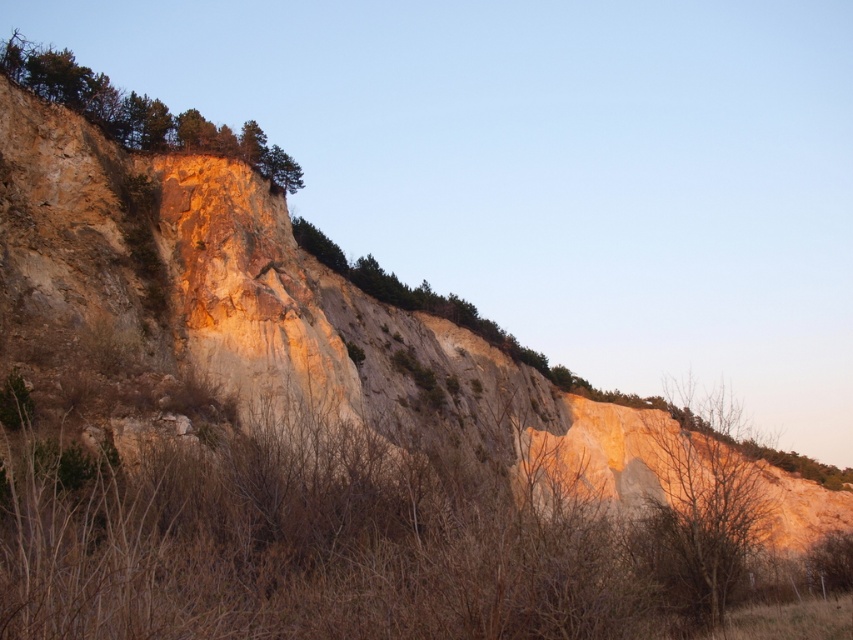
Question: Does brown textured tree at center have a smaller size compared to green rough rock at upper left?

Choices:
 (A) yes
 (B) no

Answer: (A)

Question: Which point is farther to the camera?

Choices:
 (A) (28, 68)
 (B) (669, 600)

Answer: (A)

Question: Is brown textured tree at center positioned behind green rough rock at upper left?

Choices:
 (A) no
 (B) yes

Answer: (A)

Question: Can you confirm if brown textured tree at center is wider than green rough rock at upper left?

Choices:
 (A) no
 (B) yes

Answer: (A)

Question: Which object appears farthest from the camera in this image?

Choices:
 (A) brown textured tree at center
 (B) green rough rock at upper left

Answer: (B)